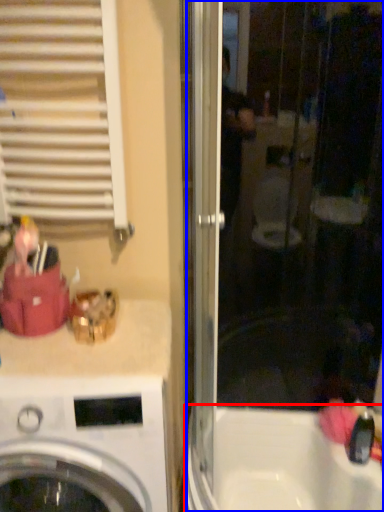
Question: Which object appears closest to the camera in this image, bath (highlighted by a red box) or screen door (highlighted by a blue box)?

Choices:
 (A) bath
 (B) screen door

Answer: (B)